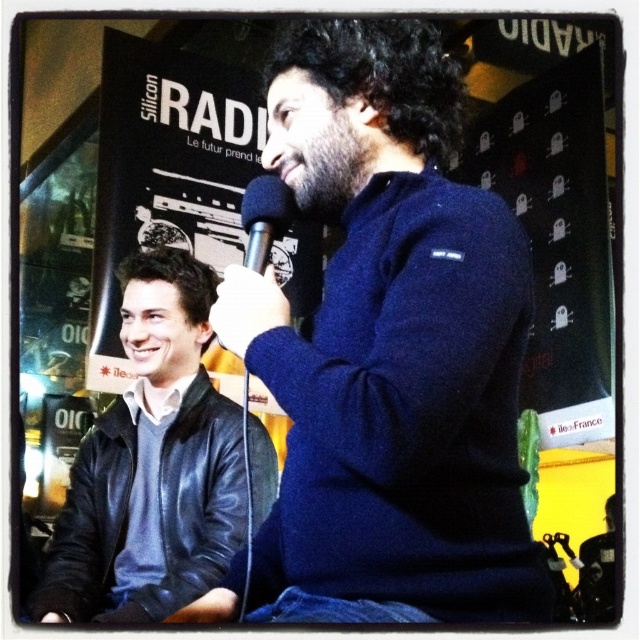
Question: Which object appears farthest from the camera in this image?

Choices:
 (A) dark brown fuzzy beard at center
 (B) black metallic microphone at center

Answer: (A)

Question: Is the position of dark blue sweater at center less distant than that of dark brown fuzzy beard at center?

Choices:
 (A) yes
 (B) no

Answer: (A)

Question: Among these objects, which one is farthest from the camera?

Choices:
 (A) leather jacket at left
 (B) black metallic microphone at center
 (C) dark blue sweater at center

Answer: (A)

Question: Does dark brown fuzzy beard at center have a lesser width compared to black metallic microphone at center?

Choices:
 (A) no
 (B) yes

Answer: (A)

Question: Is dark brown fuzzy beard at center above black metallic microphone at center?

Choices:
 (A) yes
 (B) no

Answer: (A)

Question: Which object appears closest to the camera in this image?

Choices:
 (A) dark brown fuzzy beard at center
 (B) black metallic microphone at center
 (C) dark blue sweater at center
 (D) leather jacket at left

Answer: (C)